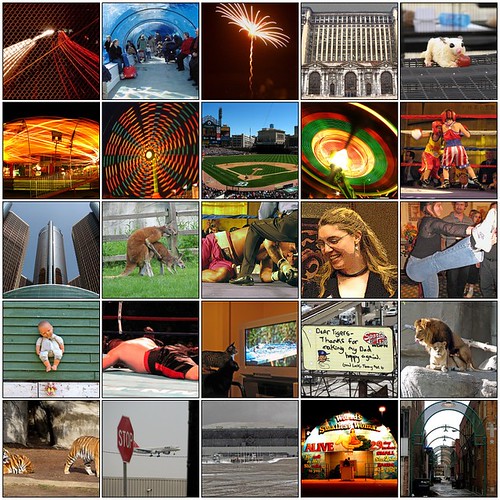
At what (x,y) coordinates should I click in order to perform the action: click on photos on bottom of image collage. Please return your answer as a coordinate pair (x, y). This screenshot has width=500, height=500. Looking at the image, I should click on pyautogui.click(x=70, y=442), pyautogui.click(x=128, y=449), pyautogui.click(x=253, y=458), pyautogui.click(x=352, y=460), pyautogui.click(x=465, y=459).